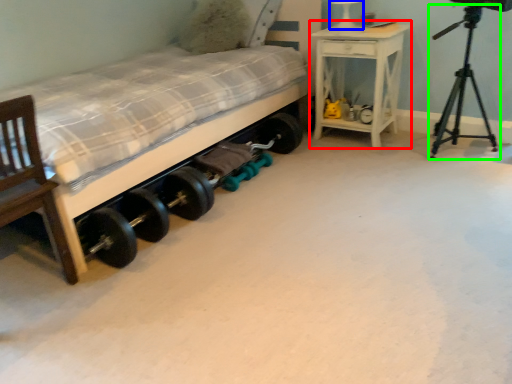
Question: Considering the real-world distances, which object is farthest from nightstand (highlighted by a red box)? table lamp (highlighted by a blue box) or tripod (highlighted by a green box)?

Choices:
 (A) table lamp
 (B) tripod

Answer: (B)